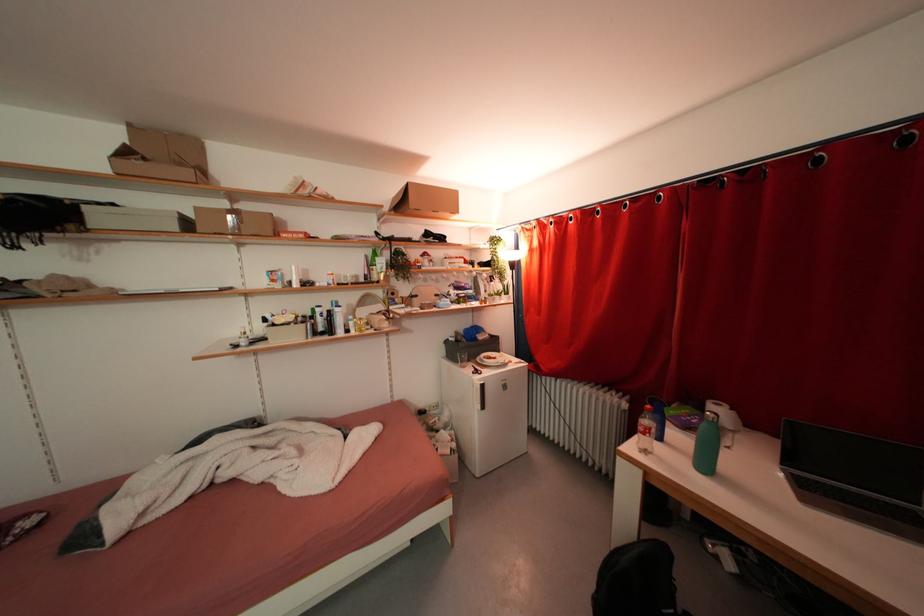
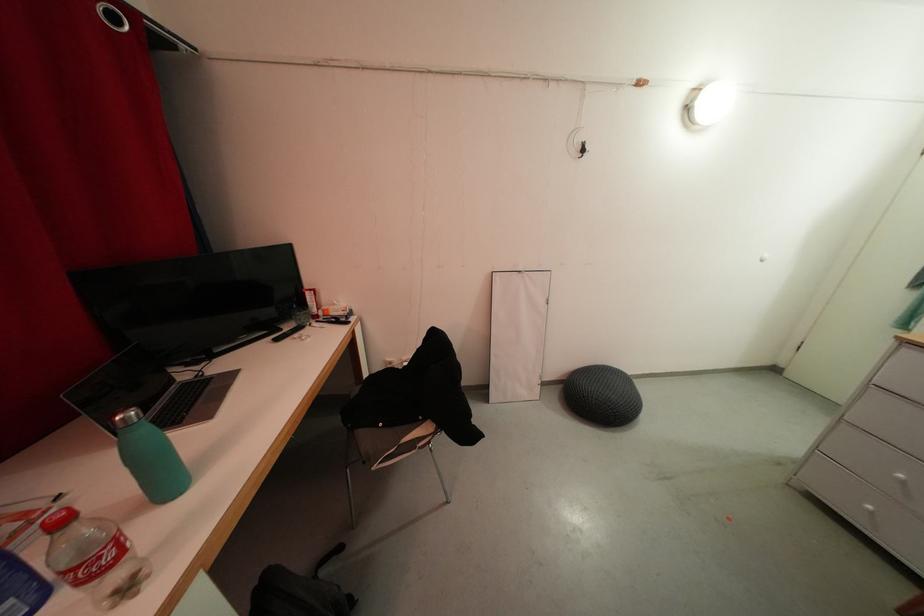
Where in the second image is the point corresponding to (x=650, y=455) from the first image?

(134, 593)